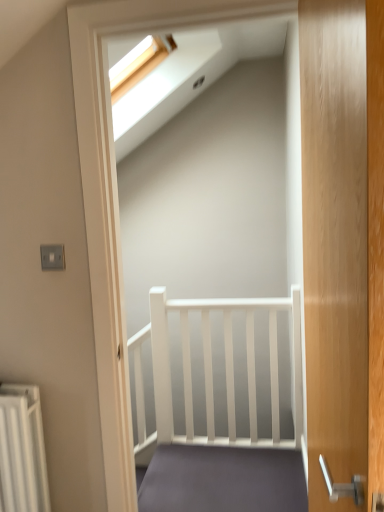
In order to face matte gray carpet at center, should I rotate leftwards or rightwards?

Turn right approximately 4.320 degrees to face it.

Find the location of a particular element. This screenshot has width=384, height=512. matte gray carpet at center is located at coordinates (223, 480).

What do you see at coordinates (223, 480) in the screenshot? I see `matte gray carpet at center` at bounding box center [223, 480].

Based on the photo, in order to face wooden door at right, should I rotate leftwards or rightwards?

To align with it, rotate right about 19.356°.

You are a GUI agent. You are given a task and a screenshot of the screen. Output one action in this format:
    pyautogui.click(x=<x>, y=<y>)
    Task: Click on the wooden door at right
    The height and width of the screenshot is (512, 384).
    Given the screenshot: What is the action you would take?
    pyautogui.click(x=334, y=241)

The height and width of the screenshot is (512, 384). Describe the element at coordinates (334, 241) in the screenshot. I see `wooden door at right` at that location.

The image size is (384, 512). I want to click on matte gray carpet at center, so click(x=223, y=480).

Is matte gray carpet at center to the right of wooden door at right from the viewer's perspective?

In fact, matte gray carpet at center is to the left of wooden door at right.

Between matte gray carpet at center and wooden door at right, which one is positioned in front?

wooden door at right is in front.

Which is in front, point (240, 467) or point (327, 94)?

The point (327, 94) is closer to the camera.

From the image's perspective, relative to wooden door at right, is matte gray carpet at center above or below?

matte gray carpet at center is below wooden door at right.

From a real-world perspective, who is located higher, matte gray carpet at center or wooden door at right?

wooden door at right is physically above.

Considering the sizes of matte gray carpet at center and wooden door at right in the image, is matte gray carpet at center wider or thinner than wooden door at right?

Clearly, matte gray carpet at center has more width compared to wooden door at right.

Is matte gray carpet at center taller or shorter than wooden door at right?

Clearly, matte gray carpet at center is shorter compared to wooden door at right.

Considering the sizes of objects matte gray carpet at center and wooden door at right in the image provided, who is bigger, matte gray carpet at center or wooden door at right?

Bigger between the two is wooden door at right.

Can wooden door at right be found inside matte gray carpet at center?

No, wooden door at right is located outside of matte gray carpet at center.

Is matte gray carpet at center not near wooden door at right?

Yes, matte gray carpet at center and wooden door at right are located far from each other.

Does matte gray carpet at center turn towards wooden door at right?

No, matte gray carpet at center is not aimed at wooden door at right.

Can you tell me how much matte gray carpet at center and wooden door at right differ in facing direction?

There is a 90.5-degree angle between the facing directions of matte gray carpet at center and wooden door at right.

How much distance is there between matte gray carpet at center and wooden door at right?

The distance of matte gray carpet at center from wooden door at right is 1.35 meters.

Locate an element on the screen. door located in front of the matte gray carpet at center is located at coordinates [334, 241].

Considering the positions of objects wooden door at right and matte gray carpet at center in the image provided, who is more to the right, wooden door at right or matte gray carpet at center?

wooden door at right.

Looking at this image, is wooden door at right further to the viewer compared to matte gray carpet at center?

No, wooden door at right is in front of matte gray carpet at center.

Does point (313, 12) come behind point (253, 468)?

That is False.

From the image's perspective, is wooden door at right over matte gray carpet at center?

Yes, from the image's perspective, wooden door at right is above matte gray carpet at center.

From a real-world perspective, which object rests below the other?

matte gray carpet at center is physically lower.

Considering the relative sizes of wooden door at right and matte gray carpet at center in the image provided, is wooden door at right thinner than matte gray carpet at center?

Correct, the width of wooden door at right is less than that of matte gray carpet at center.

Considering the relative sizes of wooden door at right and matte gray carpet at center in the image provided, is wooden door at right taller than matte gray carpet at center?

Yes.

Considering the relative sizes of wooden door at right and matte gray carpet at center in the image provided, is wooden door at right bigger than matte gray carpet at center?

Yes.

Is wooden door at right positioned beyond the bounds of matte gray carpet at center?

Indeed, wooden door at right is completely outside matte gray carpet at center.

Does wooden door at right touch matte gray carpet at center?

No, wooden door at right is not touching matte gray carpet at center.

Is wooden door at right facing away from matte gray carpet at center?

No, wooden door at right is not facing away from matte gray carpet at center.

Where is `door above the matte gray carpet at center (from the image's perspective)`? door above the matte gray carpet at center (from the image's perspective) is located at coordinates [334, 241].

Where is `stairs that is below the wooden door at right (from the image's perspective)`? stairs that is below the wooden door at right (from the image's perspective) is located at coordinates (223, 480).

The height and width of the screenshot is (512, 384). In order to click on door above the matte gray carpet at center (from the image's perspective) in this screenshot , I will do `click(334, 241)`.